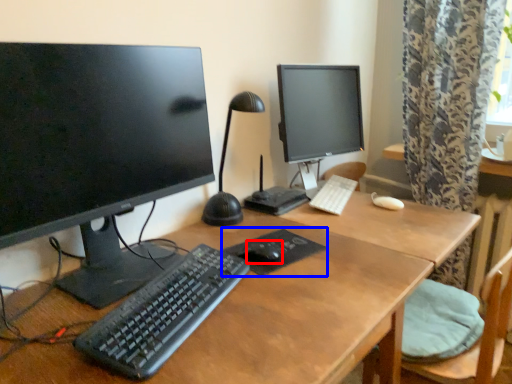
Question: Among these objects, which one is nearest to the camera, mouse (highlighted by a red box) or mousepad (highlighted by a blue box)?

Choices:
 (A) mouse
 (B) mousepad

Answer: (B)